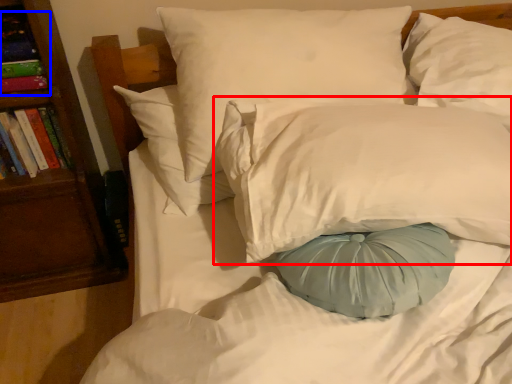
Question: Which of the following is the closest to the observer, pillow (highlighted by a red box) or book (highlighted by a blue box)?

Choices:
 (A) pillow
 (B) book

Answer: (A)